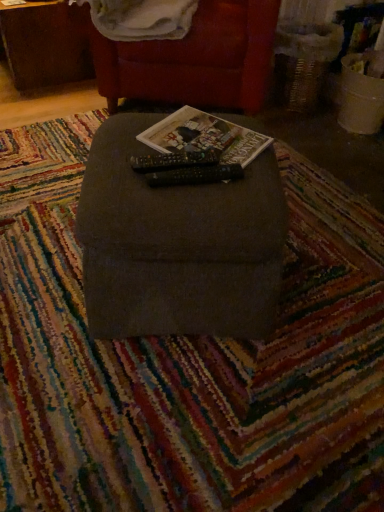
Where is `vacant region in front of matte paper magazine at center`? This screenshot has height=512, width=384. vacant region in front of matte paper magazine at center is located at coordinates (197, 200).